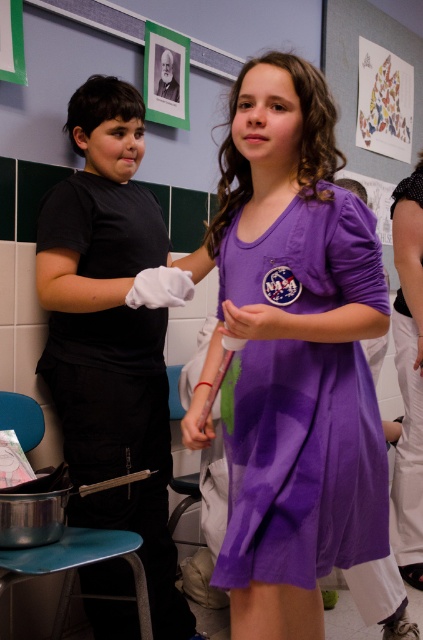
What do you see at coordinates (294, 356) in the screenshot? I see `purple cotton dress at center` at bounding box center [294, 356].

Locate an element on the screen. The width and height of the screenshot is (423, 640). purple cotton dress at center is located at coordinates (294, 356).

Who is higher up, black matte shirt at left or metallic blue stool at lower left?

black matte shirt at left is higher up.

Describe the element at coordinates (110, 333) in the screenshot. I see `black matte shirt at left` at that location.

Where is `black matte shirt at left`? black matte shirt at left is located at coordinates (110, 333).

Is purple fabric hand at center closer to camera compared to matte purple dress at center?

That is True.

Is purple fabric hand at center to the left of matte purple dress at center from the viewer's perspective?

In fact, purple fabric hand at center is to the right of matte purple dress at center.

Locate an element on the screen. The width and height of the screenshot is (423, 640). purple fabric hand at center is located at coordinates (258, 323).